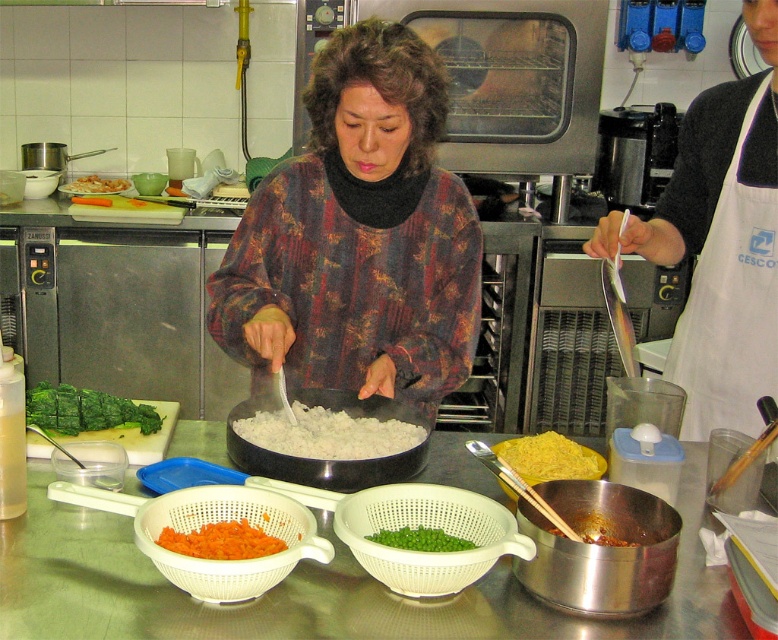
Does point (710, 136) come in front of point (244, 545)?

No, it is behind (244, 545).

In the scene shown: Is white fabric apron at right positioned at the back of orange shredded carrot at center?

Yes, white fabric apron at right is behind orange shredded carrot at center.

Image resolution: width=778 pixels, height=640 pixels. In order to click on white fabric apron at right in this screenshot , I will do `click(726, 262)`.

Which is more to the left, white plastic colander at center or white matte wok at center?

white matte wok at center

The height and width of the screenshot is (640, 778). What do you see at coordinates (426, 528) in the screenshot?
I see `white plastic colander at center` at bounding box center [426, 528].

This screenshot has width=778, height=640. Find the location of `white plastic colander at center`. white plastic colander at center is located at coordinates (426, 528).

Is green leafy vegetable at center below green matte peas at center?

No, green leafy vegetable at center is not below green matte peas at center.

Does green leafy vegetable at center appear on the left side of green matte peas at center?

Yes, green leafy vegetable at center is to the left of green matte peas at center.

Is point (55, 404) farther from viewer compared to point (447, 545)?

That is True.

Find the location of a particular element. This screenshot has width=778, height=640. green leafy vegetable at center is located at coordinates (83, 410).